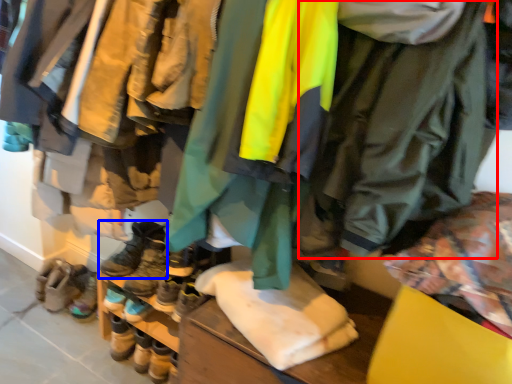
Question: Which of the following is the closest to the observer, jacket (highlighted by a red box) or footwear (highlighted by a blue box)?

Choices:
 (A) jacket
 (B) footwear

Answer: (A)